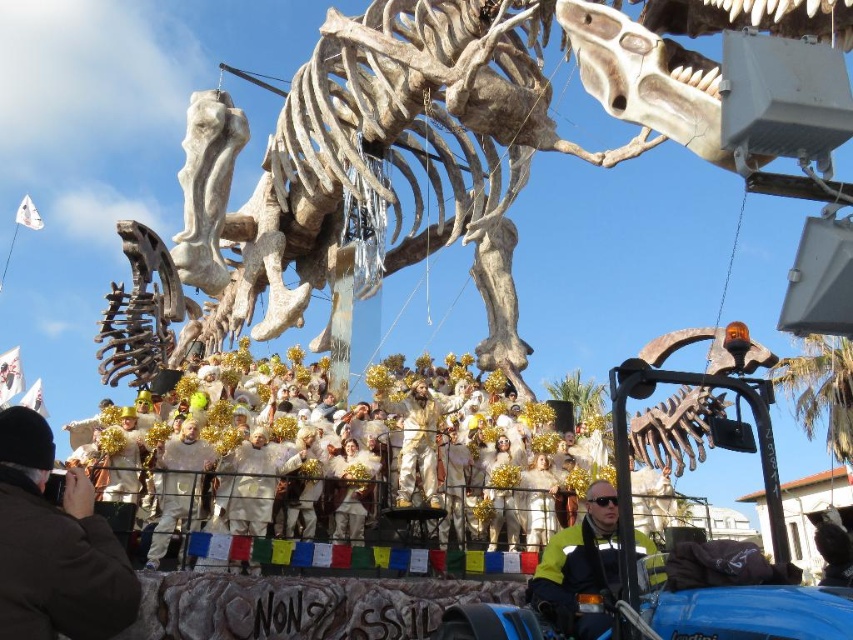
Does black fabric at lower left come behind yellow reflective jacket at lower center?

No, it is in front of yellow reflective jacket at lower center.

Looking at this image, can you confirm if black fabric at lower left is taller than yellow reflective jacket at lower center?

Yes, black fabric at lower left is taller than yellow reflective jacket at lower center.

I want to click on black fabric at lower left, so click(x=54, y=545).

Does white fluffy costumes at center have a larger size compared to black fabric at lower left?

Indeed, white fluffy costumes at center has a larger size compared to black fabric at lower left.

Identify the location of white fluffy costumes at center. Image resolution: width=853 pixels, height=640 pixels. (265, 464).

Describe the element at coordinates (265, 464) in the screenshot. Image resolution: width=853 pixels, height=640 pixels. I see `white fluffy costumes at center` at that location.

Find the location of a particular element. The width and height of the screenshot is (853, 640). white fluffy costumes at center is located at coordinates (265, 464).

Does white fluffy costumes at center lie in front of gold metallic costume at center?

Yes, white fluffy costumes at center is closer to the viewer.

Does white fluffy costumes at center have a lesser width compared to gold metallic costume at center?

In fact, white fluffy costumes at center might be wider than gold metallic costume at center.

Is point (306, 529) positioned in front of point (402, 483)?

Yes, it is in front of point (402, 483).

You are a GUI agent. You are given a task and a screenshot of the screen. Output one action in this format:
    pyautogui.click(x=<x>, y=<y>)
    Task: Click on the white fluffy costumes at center
    
    Given the screenshot: What is the action you would take?
    pyautogui.click(x=265, y=464)